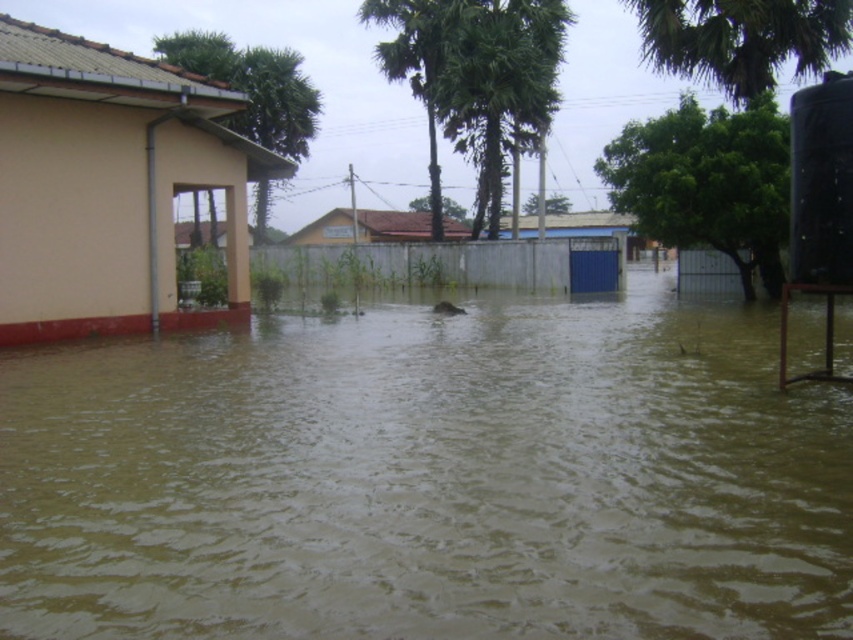
You are a drone operator tasked with assessing flood damage. You notice a green leafy palm tree at upper center and a beige building with a red base on the left. Which object is closer to the point marked at coordinates (x=474, y=77)?

The green leafy palm tree at upper center is located at the point marked at coordinates (x=474, y=77), so it is closer to that point than the beige building with a red base on the left.

You are a rescue worker trying to assess the situation. You see the brown murky water at center and the green leafy palm tree at upper center. Which object is taller?

The green leafy palm tree at upper center is taller than the brown murky water at center.

You are a rescue worker assessing the flooded area. You see a green leafy palm tree at upper center and a black matte water tank at right. Which object is bigger in size?

The green leafy palm tree at upper center is larger in size than the black matte water tank at right.